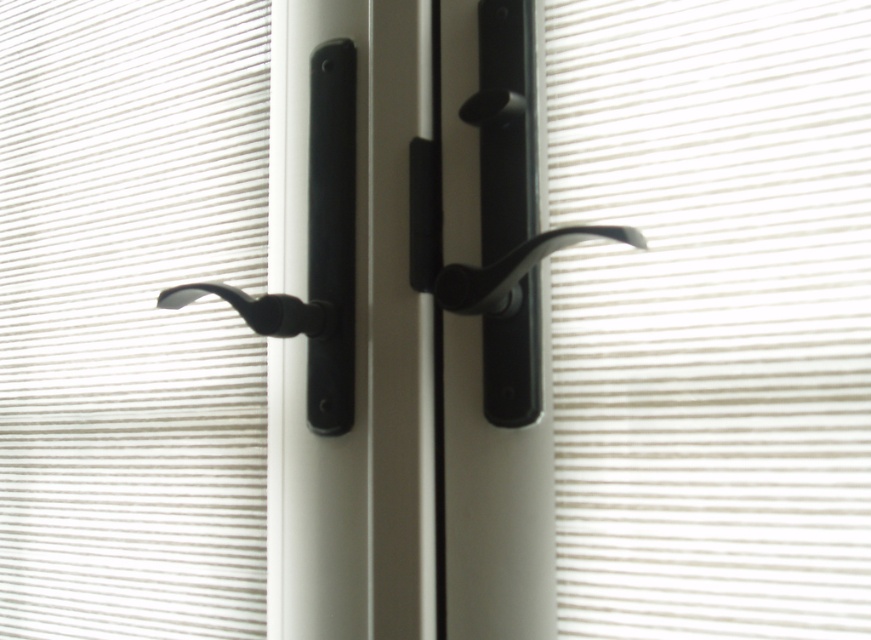
You are standing in front of the door with two points marked on it. You want to touch the point that is closer to you. Which point should you choose between point (637, 576) and point (335, 369)?

Point (637, 576) is closer to the camera than point (335, 369), so you should choose point (637, 576).

You are trying to determine which object is taller between the white matte blind at center and the matte black lever at center in the image. Based on their positions, which one is taller?

The white matte blind at center is taller than the matte black lever at center.